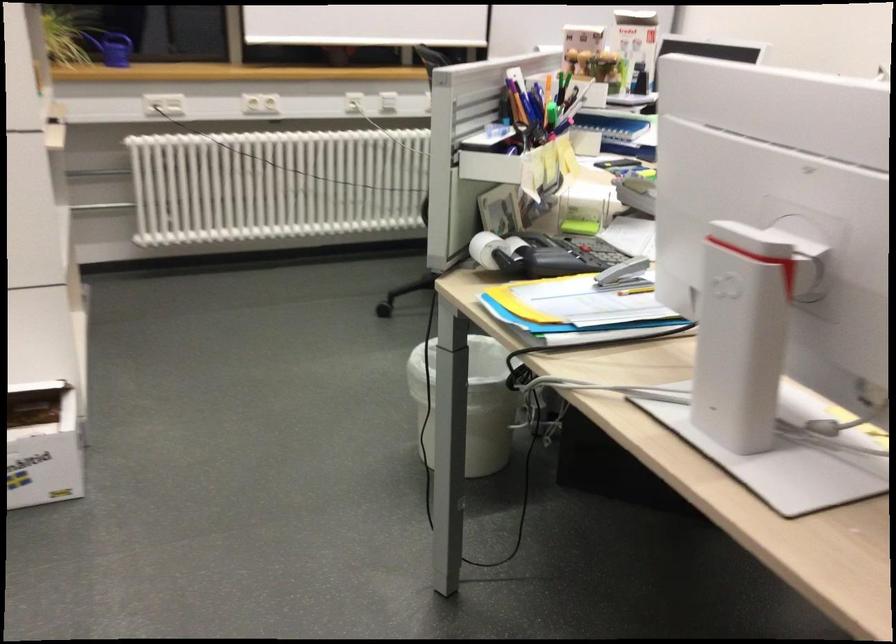
Find the location of a particular element. blue watering can is located at coordinates (112, 48).